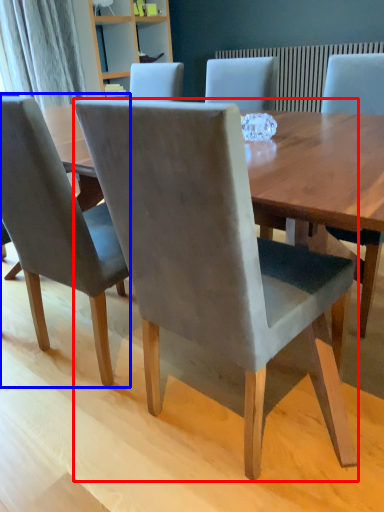
Question: Among these objects, which one is farthest to the camera, chair (highlighted by a red box) or chair (highlighted by a blue box)?

Choices:
 (A) chair
 (B) chair

Answer: (B)